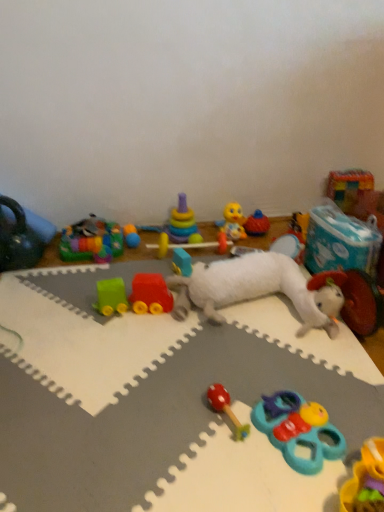
In order to face rubber duck at center, the 12th toy when ordered from left to right, should I rotate leftwards or rightwards?

A 8.789 degree turn to the right will do.

Locate an element on the screen. rubber duck at center, the fourth toy positioned from the right is located at coordinates (256, 224).

How much space does plastic colorful blocks at upper right, which is the first toy in right-to-left order, occupy vertically?

plastic colorful blocks at upper right, which is the first toy in right-to-left order, is 10.64 inches tall.

The height and width of the screenshot is (512, 384). Describe the element at coordinates (299, 430) in the screenshot. I see `blue rubber toy at lower right, arranged as the eleventh toy when viewed from the left` at that location.

What do you see at coordinates (150, 392) in the screenshot?
I see `white plush toy at center, the eighth toy viewed from the left` at bounding box center [150, 392].

Identify the location of rubberized plastic toy at center, which is the tenth toy in right-to-left order. This screenshot has height=512, width=384. (190, 244).

Between matte black kettlebell at left, the first toy from the left, and rubber ball at center, the thirteenth toy when ordered from right to left, which one is positioned in front?

matte black kettlebell at left, the first toy from the left, is more forward.

How far apart are matte black kettlebell at left, placed as the 15th toy when sorted from right to left, and rubber ball at center, which appears as the 3th toy when viewed from the left?

15.86 inches.

Is matte black kettlebell at left, placed as the 15th toy when sorted from right to left, positioned beyond the bounds of rubber ball at center, the thirteenth toy when ordered from right to left?

Yes.

Considering the positions of points (14, 249) and (137, 242), is point (14, 249) closer to camera compared to point (137, 242)?

That is True.

From a real-world perspective, count 5th toys downward from the stacked plastic rings at center, the 4th toy from the left, and point to it. Please provide its 2D coordinates.

[(256, 224)]

Is rubber duck at center, the 12th toy when ordered from left to right, next to stacked plastic rings at center, which is the 12th toy from right to left?

They are not placed beside each other.

Is rubber duck at center, the fourth toy positioned from the right, outside of stacked plastic rings at center, the 4th toy from the left?

Indeed, rubber duck at center, the fourth toy positioned from the right, is completely outside stacked plastic rings at center, the 4th toy from the left.

Considering the sizes of objects rubber duck at center, the fourth toy positioned from the right, and stacked plastic rings at center, the 4th toy from the left, in the image provided, who is shorter, rubber duck at center, the fourth toy positioned from the right, or stacked plastic rings at center, the 4th toy from the left,?

With less height is rubber duck at center, the fourth toy positioned from the right.

Is multicolored plastic rainbow at upper left, positioned as the 14th toy in right-to-left order, to the left of blue rubber toy at lower right, arranged as the eleventh toy when viewed from the left, from the viewer's perspective?

Correct, you'll find multicolored plastic rainbow at upper left, positioned as the 14th toy in right-to-left order, to the left of blue rubber toy at lower right, arranged as the eleventh toy when viewed from the left.

Which of these two, multicolored plastic rainbow at upper left, positioned as the 14th toy in right-to-left order, or blue rubber toy at lower right, arranged as the eleventh toy when viewed from the left, is bigger?

Bigger between the two is multicolored plastic rainbow at upper left, positioned as the 14th toy in right-to-left order.

This screenshot has width=384, height=512. I want to click on the 9th toy counting from the right of the multicolored plastic rainbow at upper left, the 2th toy when ordered from left to right, so click(299, 430).

How many degrees apart are the facing directions of multicolored plastic rainbow at upper left, positioned as the 14th toy in right-to-left order, and blue rubber toy at lower right, which is the fifth toy in right-to-left order?

The angular difference between multicolored plastic rainbow at upper left, positioned as the 14th toy in right-to-left order, and blue rubber toy at lower right, which is the fifth toy in right-to-left order, is 70.6 degrees.

Is rubberized plastic toy at center, marked as the sixth toy in a left-to-right arrangement, shorter than rubber ball at center, which appears as the 3th toy when viewed from the left?

Incorrect, the height of rubberized plastic toy at center, marked as the sixth toy in a left-to-right arrangement, does not fall short of that of rubber ball at center, which appears as the 3th toy when viewed from the left.

Is rubberized plastic toy at center, which is the tenth toy in right-to-left order, further to the viewer compared to rubber ball at center, which appears as the 3th toy when viewed from the left?

No, rubberized plastic toy at center, which is the tenth toy in right-to-left order, is closer to the camera.

From a real-world perspective, is rubberized plastic toy at center, which is the tenth toy in right-to-left order, above or below rubber ball at center, which appears as the 3th toy when viewed from the left?

rubberized plastic toy at center, which is the tenth toy in right-to-left order, is situated higher than rubber ball at center, which appears as the 3th toy when viewed from the left, in the real world.

Consider the image. Is rubberized plastic toy at center, marked as the sixth toy in a left-to-right arrangement, to the left of rubber ball at center, the thirteenth toy when ordered from right to left, from the viewer's perspective?

Incorrect, rubberized plastic toy at center, marked as the sixth toy in a left-to-right arrangement, is not on the left side of rubber ball at center, the thirteenth toy when ordered from right to left.

Is rubber duck at center, the 12th toy when ordered from left to right, completely or partially outside of white plush toy at center, the eighth toy viewed from the left?

Yes, rubber duck at center, the 12th toy when ordered from left to right, is not within white plush toy at center, the eighth toy viewed from the left.

Who is shorter, rubber duck at center, the fourth toy positioned from the right, or white plush toy at center, the eighth toy viewed from the left?

white plush toy at center, the eighth toy viewed from the left, is shorter.

Considering the relative positions of rubber duck at center, the fourth toy positioned from the right, and white plush toy at center, the eighth toy viewed from the left, in the image provided, is rubber duck at center, the fourth toy positioned from the right, in front of white plush toy at center, the eighth toy viewed from the left,?

No, rubber duck at center, the fourth toy positioned from the right, is further to the viewer.

Considering the positions of objects rubberized plastic toy at center, marked as the sixth toy in a left-to-right arrangement, and white plush toy at center, the 8th toy from the right, in the image provided, who is behind, rubberized plastic toy at center, marked as the sixth toy in a left-to-right arrangement, or white plush toy at center, the 8th toy from the right,?

rubberized plastic toy at center, marked as the sixth toy in a left-to-right arrangement, is further away from the camera.

From the image's perspective, is rubberized plastic toy at center, which is the tenth toy in right-to-left order, above or below white plush toy at center, the eighth toy viewed from the left?

From the image's perspective, rubberized plastic toy at center, which is the tenth toy in right-to-left order, appears above white plush toy at center, the eighth toy viewed from the left.

Is rubberized plastic toy at center, marked as the sixth toy in a left-to-right arrangement, oriented towards white plush toy at center, the 8th toy from the right?

Yes, rubberized plastic toy at center, marked as the sixth toy in a left-to-right arrangement, is oriented towards white plush toy at center, the 8th toy from the right.

Which toy is the 8th one when counting from the back of the white plush toy at center, the 8th toy from the right? Please provide its 2D coordinates.

[(190, 244)]

Based on the photo, measure the distance from smooth red wooden rattle at center, which ranks as the 7th toy in left-to-right order, to white plush toy at right, the second toy positioned from the right.

They are 25.12 inches apart.

From the image's perspective, between smooth red wooden rattle at center, the 9th toy in the right-to-left sequence, and white plush toy at right, which is the fourteenth toy from left to right, which one is located above?

white plush toy at right, which is the fourteenth toy from left to right.

From a real-world perspective, is smooth red wooden rattle at center, the 9th toy in the right-to-left sequence, physically located above or below white plush toy at right, which is the fourteenth toy from left to right?

smooth red wooden rattle at center, the 9th toy in the right-to-left sequence, is below white plush toy at right, which is the fourteenth toy from left to right.

Is smooth red wooden rattle at center, which ranks as the 7th toy in left-to-right order, oriented towards white plush toy at right, which is the fourteenth toy from left to right?

No, smooth red wooden rattle at center, which ranks as the 7th toy in left-to-right order, is not oriented towards white plush toy at right, which is the fourteenth toy from left to right.

Identify the location of the 7th toy in front of the rubber ball at center, which appears as the 3th toy when viewed from the left, counting from the anchor's position. This screenshot has height=512, width=384. (18, 239).

From the image's perspective, starting from the rubber duck at center, the fourth toy positioned from the right, which toy is the 1st one above? Please provide its 2D coordinates.

[(183, 223)]

From the image, which object appears to be farther from white plush lamb at center, placed as the ninth toy when sorted from left to right, rubber ball at center, the thirteenth toy when ordered from right to left, or blue rubber toy at lower right, arranged as the eleventh toy when viewed from the left?

rubber ball at center, the thirteenth toy when ordered from right to left, is further to white plush lamb at center, placed as the ninth toy when sorted from left to right.

Considering their positions, is smooth red wooden rattle at center, which ranks as the 7th toy in left-to-right order, positioned closer to blue rubber toy at lower right, which is the fifth toy in right-to-left order, than multicolored plastic rainbow at upper left, positioned as the 14th toy in right-to-left order?

smooth red wooden rattle at center, which ranks as the 7th toy in left-to-right order.

Estimate the real-world distances between objects in this image. Which object is further from blue rubber toy at lower right, which is the fifth toy in right-to-left order, matte black kettlebell at left, placed as the 15th toy when sorted from right to left, or plastic colorful blocks at upper right, which is the first toy in right-to-left order?

Answer: matte black kettlebell at left, placed as the 15th toy when sorted from right to left, is positioned further to the anchor blue rubber toy at lower right, which is the fifth toy in right-to-left order.

Based on the photo, estimate the real-world distances between objects in this image. Which object is further from smooth red wooden rattle at center, the 9th toy in the right-to-left sequence, matte black kettlebell at left, placed as the 15th toy when sorted from right to left, or multicolored plastic rainbow at upper left, positioned as the 14th toy in right-to-left order?

matte black kettlebell at left, placed as the 15th toy when sorted from right to left, is further to smooth red wooden rattle at center, the 9th toy in the right-to-left sequence.

Estimate the real-world distances between objects in this image. Which object is further from rubberized plastic toy at center, which is the tenth toy in right-to-left order, plastic colorful blocks at upper right, which is the first toy in right-to-left order, or blue rubber toy at lower right, arranged as the eleventh toy when viewed from the left?

blue rubber toy at lower right, arranged as the eleventh toy when viewed from the left, is positioned further to the anchor rubberized plastic toy at center, which is the tenth toy in right-to-left order.

Based on their spatial positions, is white plush lamb at center, the 7th toy from the right, or white plush toy at center, the 8th toy from the right, closer to rubber ball at center, which appears as the 3th toy when viewed from the left?

white plush lamb at center, the 7th toy from the right, lies closer to rubber ball at center, which appears as the 3th toy when viewed from the left, than the other object.

Which object lies nearer to the anchor point matte black kettlebell at left, the first toy from the left, smooth red wooden rattle at center, the 9th toy in the right-to-left sequence, or multicolored plastic rainbow at upper left, positioned as the 14th toy in right-to-left order?

The object closer to matte black kettlebell at left, the first toy from the left, is multicolored plastic rainbow at upper left, positioned as the 14th toy in right-to-left order.

When comparing their distances from blue rubber toy at lower right, which is the fifth toy in right-to-left order, does plastic colorful blocks at upper right, which is the first toy in right-to-left order, or multicolored plastic rainbow at upper left, the 2th toy when ordered from left to right, seem further?

plastic colorful blocks at upper right, which is the first toy in right-to-left order, is positioned further to the anchor blue rubber toy at lower right, which is the fifth toy in right-to-left order.

Where is `toy between white plush toy at center, the 8th toy from the right, and blue rubber toy at lower right, arranged as the eleventh toy when viewed from the left, in the vertical direction`? toy between white plush toy at center, the 8th toy from the right, and blue rubber toy at lower right, arranged as the eleventh toy when viewed from the left, in the vertical direction is located at coordinates (226, 408).

Find the location of a particular element. The height and width of the screenshot is (512, 384). toy between blue rubber toy at lower right, arranged as the eleventh toy when viewed from the left, and white plush lamb at center, the 7th toy from the right, along the z-axis is located at coordinates (226, 408).

Find the location of a particular element. This screenshot has height=512, width=384. toy located between matte black kettlebell at left, placed as the 15th toy when sorted from right to left, and rubber ball at center, the thirteenth toy when ordered from right to left, in the left-right direction is located at coordinates (91, 241).

The width and height of the screenshot is (384, 512). What are the coordinates of `toy between multicolored plastic rainbow at upper left, positioned as the 14th toy in right-to-left order, and stacked plastic rings at center, which is the 12th toy from right to left, in the horizontal direction` in the screenshot? It's located at (131, 236).